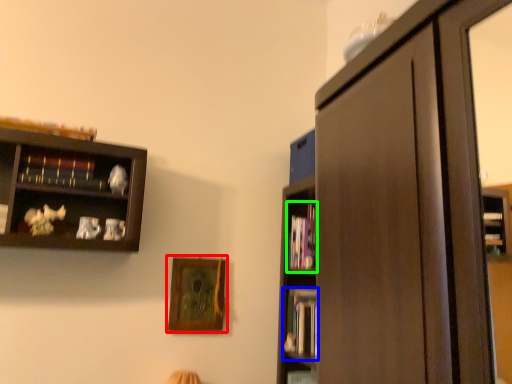
Question: Which is nearer to the picture frame (highlighted by a red box)? book (highlighted by a blue box) or book (highlighted by a green box).

Choices:
 (A) book
 (B) book

Answer: (A)